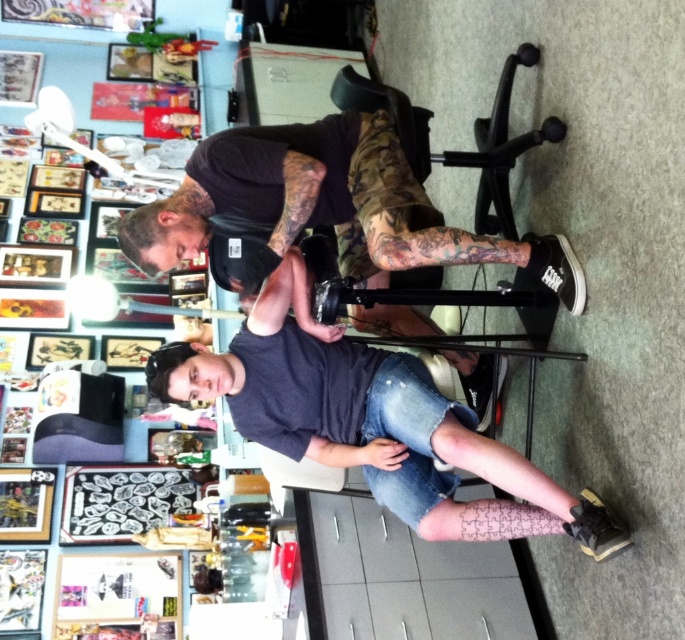
Can you confirm if matte black tattoo artist at center is smaller than black matte/black t-shirt at upper center?

No, matte black tattoo artist at center is not smaller than black matte/black t-shirt at upper center.

The height and width of the screenshot is (640, 685). Identify the location of matte black tattoo artist at center. (373, 422).

Identify the location of matte black tattoo artist at center. (373, 422).